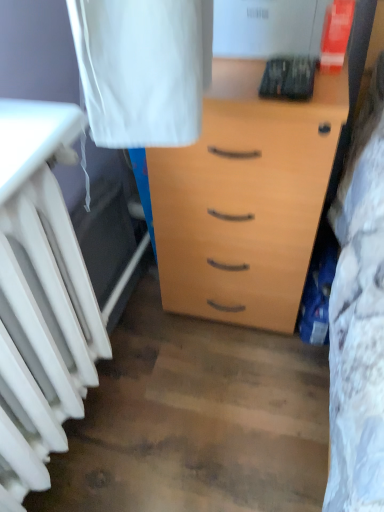
Question: In terms of size, does white matte radiator at left appear bigger or smaller than light wood chest of drawers at center?

Choices:
 (A) small
 (B) big

Answer: (A)

Question: From a real-world perspective, is white matte radiator at left positioned above or below light wood chest of drawers at center?

Choices:
 (A) above
 (B) below

Answer: (A)

Question: Considering the positions of white matte radiator at left and light wood chest of drawers at center in the image, is white matte radiator at left wider or thinner than light wood chest of drawers at center?

Choices:
 (A) wide
 (B) thin

Answer: (B)

Question: In terms of size, does light wood chest of drawers at center appear bigger or smaller than white matte radiator at left?

Choices:
 (A) big
 (B) small

Answer: (A)

Question: Considering the positions of light wood chest of drawers at center and white matte radiator at left in the image, is light wood chest of drawers at center taller or shorter than white matte radiator at left?

Choices:
 (A) tall
 (B) short

Answer: (A)

Question: Is light wood chest of drawers at center spatially inside white matte radiator at left, or outside of it?

Choices:
 (A) inside
 (B) outside

Answer: (B)

Question: Looking at their shapes, would you say light wood chest of drawers at center is wider or thinner than white matte radiator at left?

Choices:
 (A) thin
 (B) wide

Answer: (B)